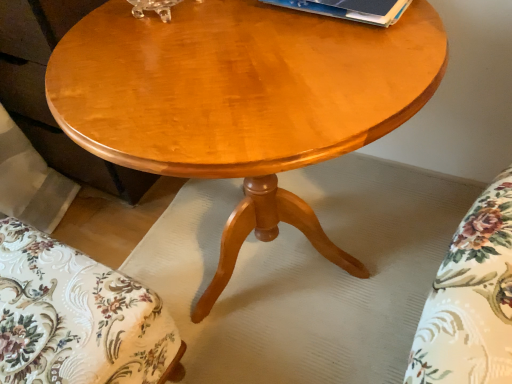
Question: From the image's perspective, is blue paper at upper center positioned above or below floral fabric cushion at lower left?

Choices:
 (A) below
 (B) above

Answer: (B)

Question: Is blue paper at upper center in front of or behind floral fabric cushion at lower left in the image?

Choices:
 (A) front
 (B) behind

Answer: (B)

Question: Estimate the real-world distances between objects in this image. Which object is closer to the floral fabric cushion at lower left?

Choices:
 (A) blue paper at upper center
 (B) glossy wood coffee table at center

Answer: (B)

Question: Estimate the real-world distances between objects in this image. Which object is farther from the blue paper at upper center?

Choices:
 (A) glossy wood coffee table at center
 (B) floral fabric cushion at lower left

Answer: (B)